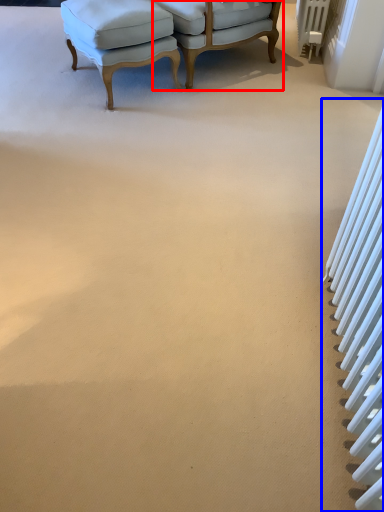
Question: Which object appears closest to the camera in this image, chair (highlighted by a red box) or radiator (highlighted by a blue box)?

Choices:
 (A) chair
 (B) radiator

Answer: (B)